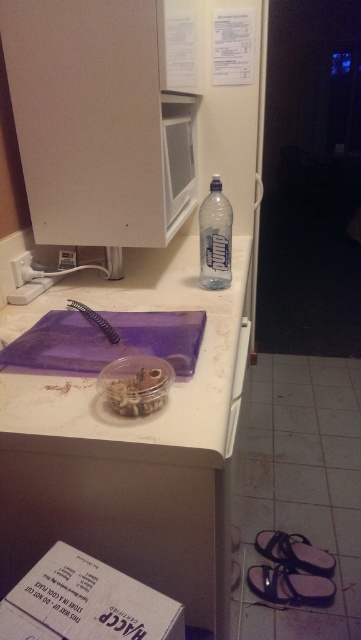
Question: Among these objects, which one is farthest from the camera?

Choices:
 (A) white plastic drawer at lower center
 (B) transparent plastic bottle at center

Answer: (B)

Question: Can you confirm if white matte cutting board at center is bigger than transparent plastic bottle at center?

Choices:
 (A) no
 (B) yes

Answer: (B)

Question: Among these points, which one is nearest to the camera?

Choices:
 (A) pyautogui.click(x=80, y=300)
 (B) pyautogui.click(x=214, y=237)

Answer: (B)

Question: Among these points, which one is farthest from the camera?

Choices:
 (A) (107, 392)
 (B) (236, 330)
 (C) (233, 444)
 (D) (224, 284)

Answer: (D)

Question: Is transparent plastic bottle at center wider than white plastic drawer at lower center?

Choices:
 (A) yes
 (B) no

Answer: (A)

Question: Observing the image, what is the correct spatial positioning of translucent plastic jar at center in reference to white plastic drawer at lower center?

Choices:
 (A) above
 (B) below

Answer: (A)